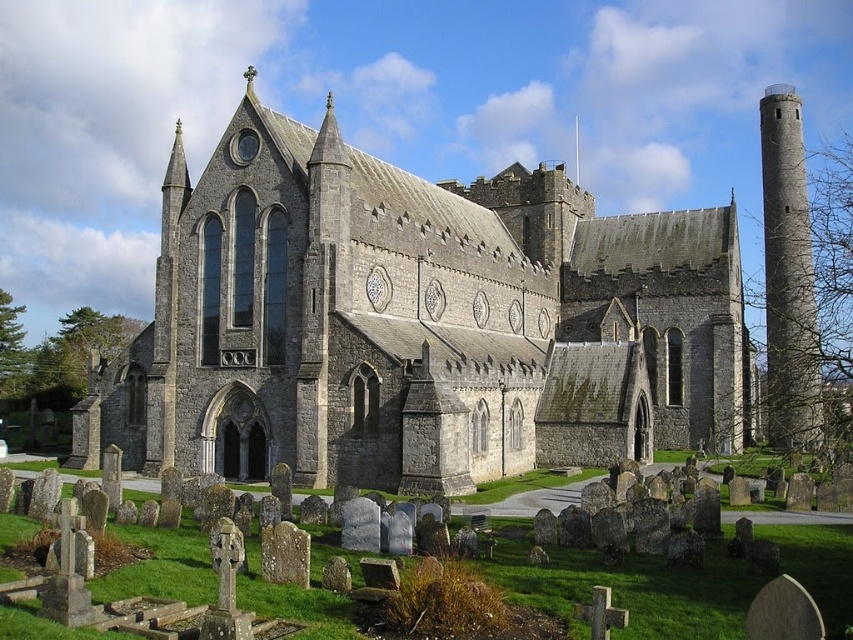
Question: Which object is positioned farthest from the gray stone church at center?

Choices:
 (A) silver metallic spire at upper center
 (B) gray stone tower at right

Answer: (A)

Question: Observing the image, what is the correct spatial positioning of gray stone church at center in reference to gray stone tower at right?

Choices:
 (A) left
 (B) right

Answer: (A)

Question: Which of the following is the closest to the observer?

Choices:
 (A) (282, 374)
 (B) (801, 305)

Answer: (A)

Question: Observing the image, what is the correct spatial positioning of gray stone tower at right in reference to silver metallic spire at upper center?

Choices:
 (A) left
 (B) right

Answer: (B)

Question: Estimate the real-world distances between objects in this image. Which object is farther from the gray stone tower at right?

Choices:
 (A) silver metallic spire at upper center
 (B) gray stone church at center

Answer: (A)

Question: Does gray stone church at center have a smaller size compared to gray stone tower at right?

Choices:
 (A) no
 (B) yes

Answer: (B)